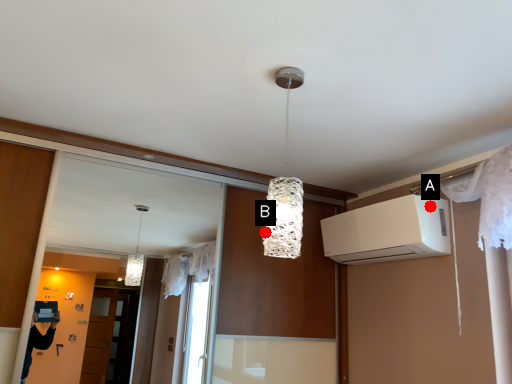
Question: Two points are circled on the image, labeled by A and B beside each circle. Which of the following is the closest to the observer?

Choices:
 (A) A is closer
 (B) B is closer

Answer: (A)